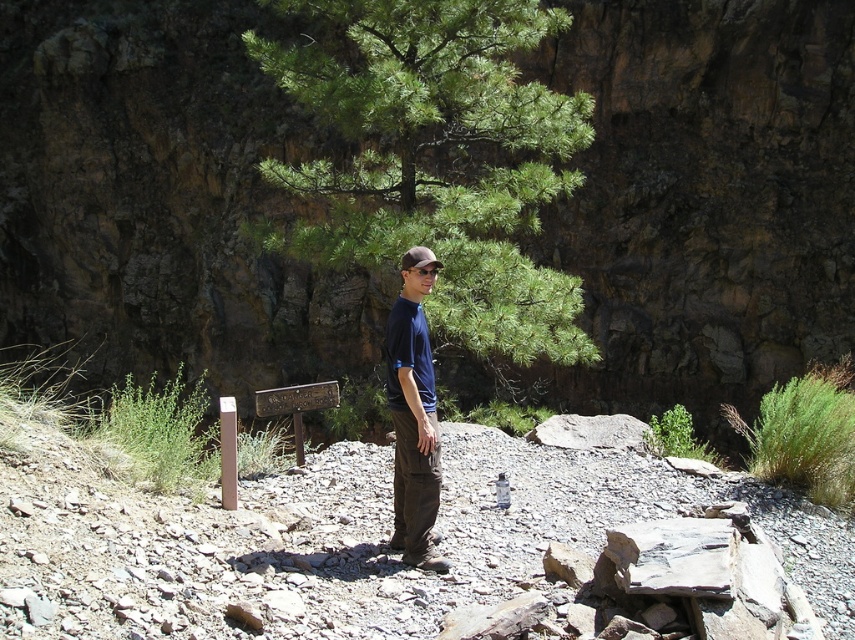
Based on the photo, who is positioned more to the right, green leafy tree at center or dark blue t-shirt at center?

dark blue t-shirt at center is more to the right.

Locate an element on the screen. green leafy tree at center is located at coordinates (437, 157).